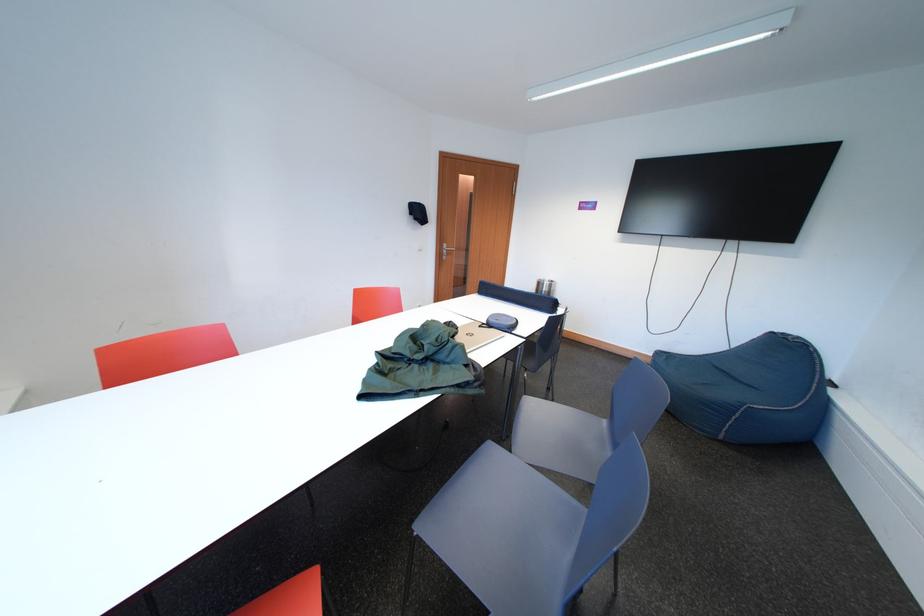
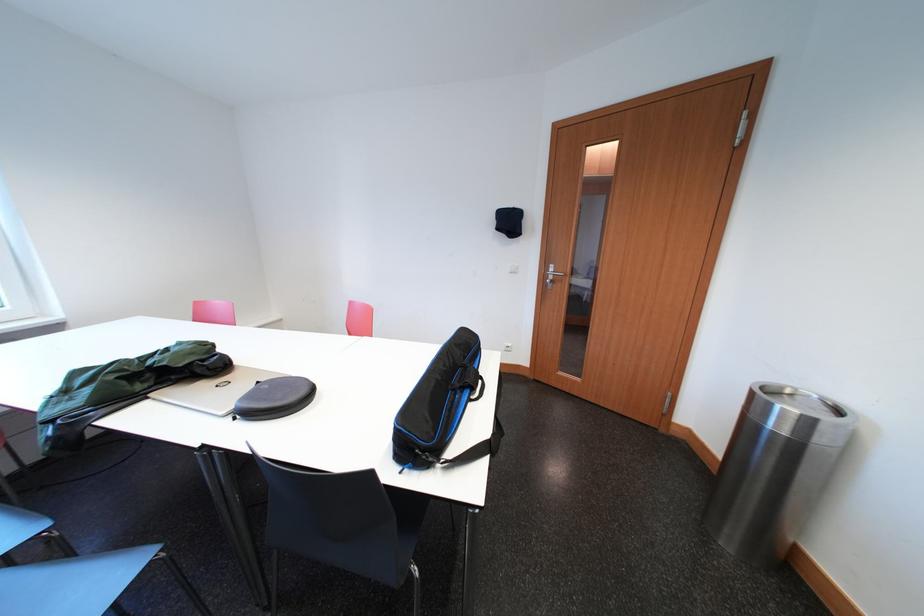
Where in the second image is the point corresponding to [560,290] from the first image?

(819, 426)